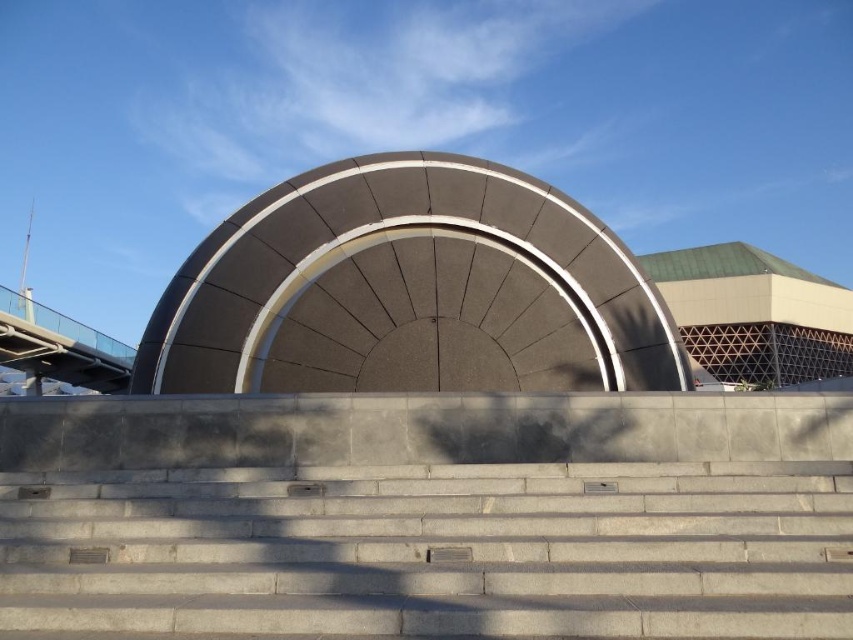
Which is behind, point (18, 483) or point (756, 355)?

Point (756, 355)

Does point (666, 524) lie in front of point (741, 272)?

Yes.

Does point (746, 476) come farther from viewer compared to point (741, 244)?

No, it is in front of (741, 244).

Locate an element on the screen. gray concrete stairs at center is located at coordinates (433, 552).